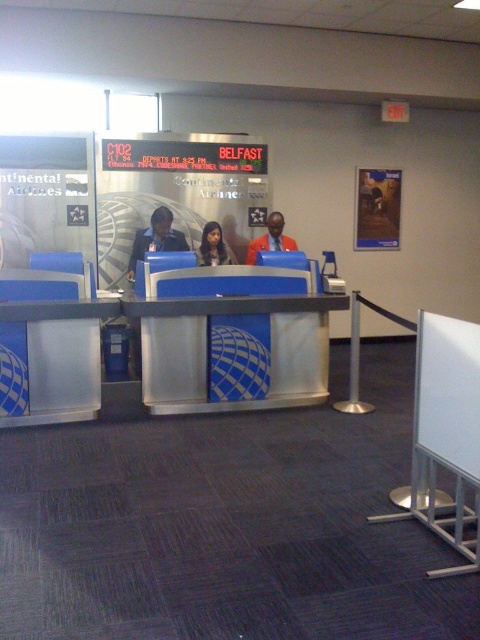
Question: Which object appears closest to the camera in this image?

Choices:
 (A) smooth skin face at center
 (B) metallic silver desk at center

Answer: (B)

Question: Which of these objects is positioned farthest from the metallic silver desk at center?

Choices:
 (A) blue fabric uniform at center
 (B) smooth skin face at center
 (C) orange fabric jacket at center

Answer: (C)

Question: From the image, what is the correct spatial relationship of orange fabric jacket at center in relation to smooth skin face at center?

Choices:
 (A) right
 (B) left

Answer: (A)

Question: Estimate the real-world distances between objects in this image. Which object is closer to the orange fabric jacket at center?

Choices:
 (A) blue fabric uniform at center
 (B) metallic silver desk at center

Answer: (A)

Question: Is metallic silver desk at center to the right of smooth skin face at center from the viewer's perspective?

Choices:
 (A) no
 (B) yes

Answer: (B)

Question: Is blue fabric uniform at center bigger than orange fabric jacket at center?

Choices:
 (A) no
 (B) yes

Answer: (B)